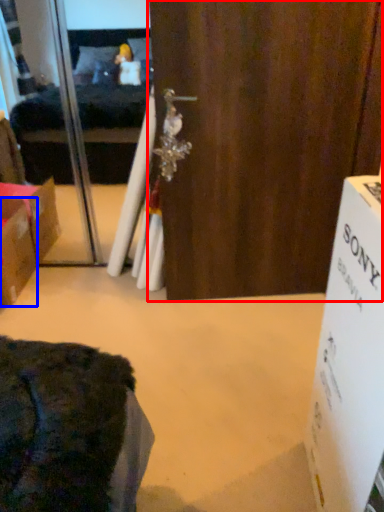
Question: Which object is closer to the camera taking this photo, door (highlighted by a red box) or box (highlighted by a blue box)?

Choices:
 (A) door
 (B) box

Answer: (A)